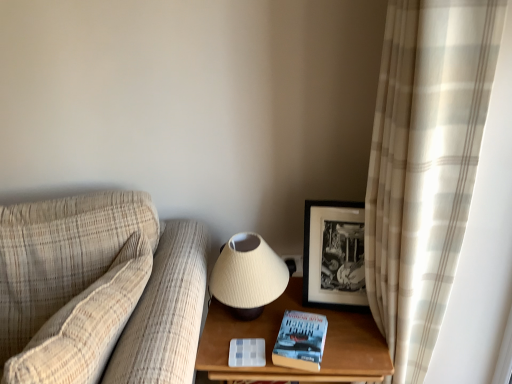
What do you see at coordinates (425, 165) in the screenshot? Image resolution: width=512 pixels, height=384 pixels. I see `beige plaid curtain at right` at bounding box center [425, 165].

Image resolution: width=512 pixels, height=384 pixels. I want to click on black matte picture frame at upper right, so click(x=334, y=255).

This screenshot has height=384, width=512. What do you see at coordinates (276, 338) in the screenshot? I see `wooden table at lower right` at bounding box center [276, 338].

What is the approximate height of matte cream lampshade at center?

matte cream lampshade at center is 11.07 inches tall.

This screenshot has width=512, height=384. Describe the element at coordinates (99, 292) in the screenshot. I see `plaid fabric couch at left` at that location.

Identify the location of hardcover blue book at lower right. This screenshot has width=512, height=384. (300, 341).

Locate an element on the screen. lamp lying in front of the black matte picture frame at upper right is located at coordinates (248, 276).

Is black matte picture frame at upper right oriented away from matte cream lampshade at center?

black matte picture frame at upper right does not have its back to matte cream lampshade at center.

Visually, is black matte picture frame at upper right positioned to the left or to the right of matte cream lampshade at center?

From the image, it's evident that black matte picture frame at upper right is to the right of matte cream lampshade at center.

Which point is more forward, (x=357, y=249) or (x=271, y=252)?

Point (x=271, y=252)

Is black matte picture frame at upper right taller or shorter than hardcover blue book at lower right?

Clearly, black matte picture frame at upper right is taller compared to hardcover blue book at lower right.

Is black matte picture frame at upper right to the left of hardcover blue book at lower right from the viewer's perspective?

No.

Is black matte picture frame at upper right facing towards hardcover blue book at lower right?

Yes, black matte picture frame at upper right is turned towards hardcover blue book at lower right.

The width and height of the screenshot is (512, 384). Find the location of `paperback book below the black matte picture frame at upper right (from a real-world perspective)`. paperback book below the black matte picture frame at upper right (from a real-world perspective) is located at coordinates (300, 341).

How different are the orientations of beige plaid curtain at right and hardcover blue book at lower right in degrees?

73.3 degrees.

At what (x,y) coordinates should I click in order to perform the action: click on curtain that appears on the right of hardcover blue book at lower right. Please return your answer as a coordinate pair (x, y). The height and width of the screenshot is (384, 512). Looking at the image, I should click on (425, 165).

From the image's perspective, is beige plaid curtain at right positioned above or below hardcover blue book at lower right?

Clearly, from the image's perspective, beige plaid curtain at right is above hardcover blue book at lower right.

How much distance is there between beige plaid curtain at right and hardcover blue book at lower right?

45.49 centimeters.

Considering the sizes of plaid fabric couch at left and matte cream lampshade at center in the image, is plaid fabric couch at left taller or shorter than matte cream lampshade at center?

plaid fabric couch at left is taller than matte cream lampshade at center.

Does point (124, 231) lie in front of point (262, 262)?

No.

Is plaid fabric couch at left smaller than matte cream lampshade at center?

Actually, plaid fabric couch at left might be larger than matte cream lampshade at center.

Does plaid fabric couch at left appear on the left side of matte cream lampshade at center?

Yes.

Is matte cream lampshade at center oriented towards plaid fabric couch at left?

No, matte cream lampshade at center is not oriented towards plaid fabric couch at left.

Considering the points (275, 280) and (156, 343), which point is behind, point (275, 280) or point (156, 343)?

The point (275, 280) is farther.

Which of these two, matte cream lampshade at center or plaid fabric couch at left, is smaller?

matte cream lampshade at center is smaller.

What's the angular difference between matte cream lampshade at center and plaid fabric couch at left's facing directions?

The facing directions of matte cream lampshade at center and plaid fabric couch at left are 0.753 degrees apart.

What's the angular difference between plaid fabric couch at left and wooden table at lower right's facing directions?

2.45 degrees separate the facing orientations of plaid fabric couch at left and wooden table at lower right.

Choose the correct answer: Is plaid fabric couch at left inside wooden table at lower right or outside it?

plaid fabric couch at left is not inside wooden table at lower right, it's outside.

Considering the positions of points (81, 262) and (385, 349), is point (81, 262) farther from camera compared to point (385, 349)?

Yes, it is behind point (385, 349).

Is plaid fabric couch at left further to the viewer compared to wooden table at lower right?

No, plaid fabric couch at left is closer to the viewer.

Relative to beige plaid curtain at right, is black matte picture frame at upper right in front or behind?

black matte picture frame at upper right is behind beige plaid curtain at right.

Is black matte picture frame at upper right spatially inside beige plaid curtain at right, or outside of it?

black matte picture frame at upper right is located beyond the bounds of beige plaid curtain at right.

Between black matte picture frame at upper right and beige plaid curtain at right, which one appears on the left side from the viewer's perspective?

From the viewer's perspective, black matte picture frame at upper right appears more on the left side.

Is black matte picture frame at upper right touching beige plaid curtain at right?

No, black matte picture frame at upper right is not next to beige plaid curtain at right.

Where is `picture frame on the right of matte cream lampshade at center`? The image size is (512, 384). picture frame on the right of matte cream lampshade at center is located at coordinates (334, 255).

Where is `paperback book that appears on the left of black matte picture frame at upper right`? paperback book that appears on the left of black matte picture frame at upper right is located at coordinates (300, 341).

In the scene shown: Considering their positions, is beige plaid curtain at right positioned further to hardcover blue book at lower right than black matte picture frame at upper right?

beige plaid curtain at right lies further to hardcover blue book at lower right than the other object.

When comparing their distances from wooden table at lower right, does hardcover blue book at lower right or black matte picture frame at upper right seem further?

Based on the image, black matte picture frame at upper right appears to be further to wooden table at lower right.

Looking at the image, which one is located closer to wooden table at lower right, black matte picture frame at upper right or hardcover blue book at lower right?

The object closer to wooden table at lower right is hardcover blue book at lower right.

Estimate the real-world distances between objects in this image. Which object is closer to beige plaid curtain at right, black matte picture frame at upper right or wooden table at lower right?

black matte picture frame at upper right is closer to beige plaid curtain at right.

When comparing their distances from black matte picture frame at upper right, does wooden table at lower right or matte cream lampshade at center seem closer?

wooden table at lower right is positioned closer to the anchor black matte picture frame at upper right.

Looking at the image, which one is located closer to plaid fabric couch at left, matte cream lampshade at center or wooden table at lower right?

matte cream lampshade at center is closer to plaid fabric couch at left.

From the image, which object appears to be nearer to hardcover blue book at lower right, plaid fabric couch at left or matte cream lampshade at center?

Among the two, matte cream lampshade at center is located nearer to hardcover blue book at lower right.

From the image, which object appears to be farther from wooden table at lower right, black matte picture frame at upper right or plaid fabric couch at left?

plaid fabric couch at left.

The image size is (512, 384). I want to click on paperback book between beige plaid curtain at right and wooden table at lower right in the up-down direction, so click(300, 341).

At what (x,y) coordinates should I click in order to perform the action: click on table situated between plaid fabric couch at left and beige plaid curtain at right from left to right. Please return your answer as a coordinate pair (x, y). Looking at the image, I should click on (276, 338).

You are a GUI agent. You are given a task and a screenshot of the screen. Output one action in this format:
    pyautogui.click(x=<x>, y=<y>)
    Task: Click on the lamp that lies between beige plaid curtain at right and wooden table at lower right from top to bottom
    This screenshot has height=384, width=512.
    Given the screenshot: What is the action you would take?
    pyautogui.click(x=248, y=276)

Where is `paperback book located between beige plaid curtain at right and black matte picture frame at upper right in the depth direction`? paperback book located between beige plaid curtain at right and black matte picture frame at upper right in the depth direction is located at coordinates (300, 341).